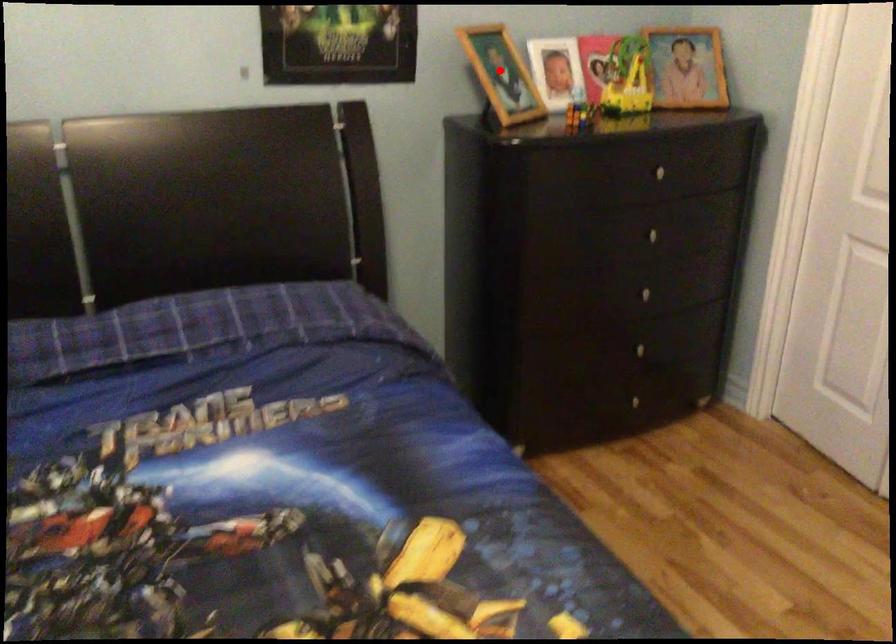
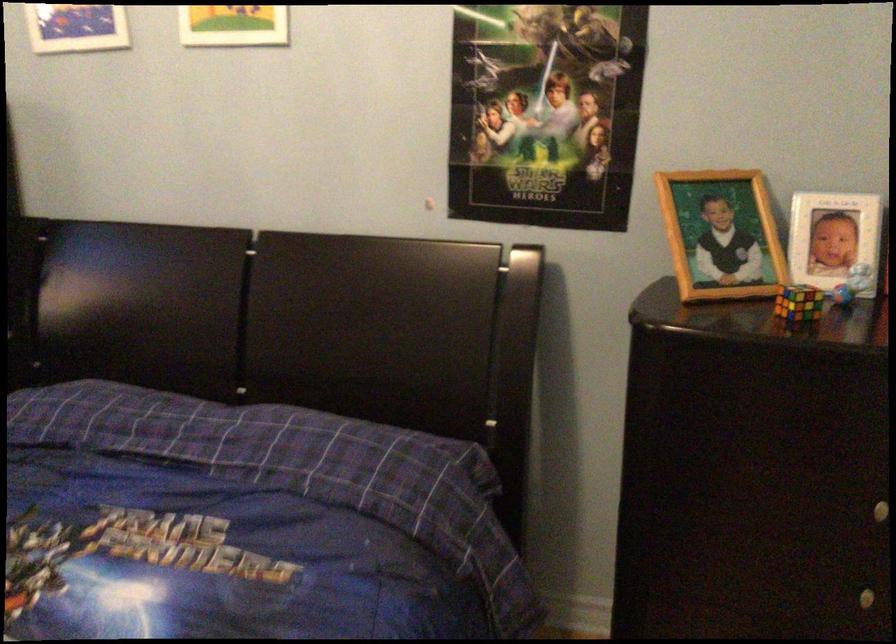
Question: I am providing you with two images of the same scene from different viewpoints. In image1, a red point is highlighted. Considering the same 3D point in image2, which of the following is correct?

Choices:
 (A) It is closer
 (B) It is farther

Answer: (A)